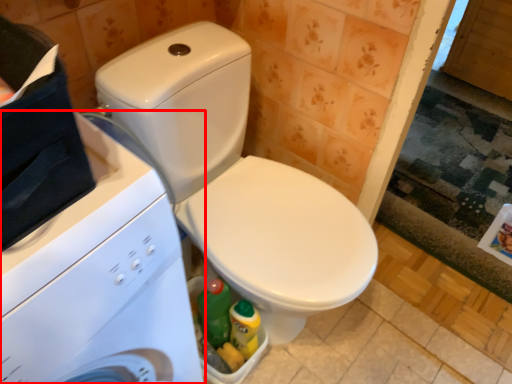
Question: In this image, where is washing machine (annotated by the red box) located relative to toilet?

Choices:
 (A) right
 (B) left

Answer: (B)